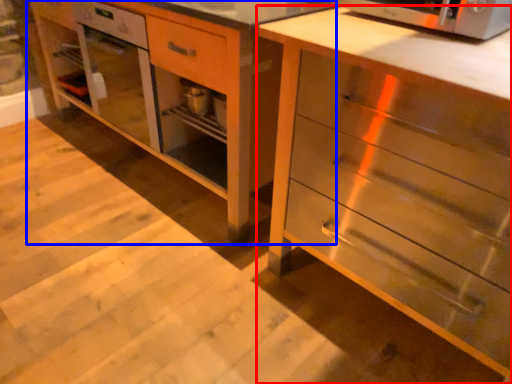
Question: Which object appears farthest to the camera in this image, chest of drawers (highlighted by a red box) or vanity (highlighted by a blue box)?

Choices:
 (A) chest of drawers
 (B) vanity

Answer: (B)